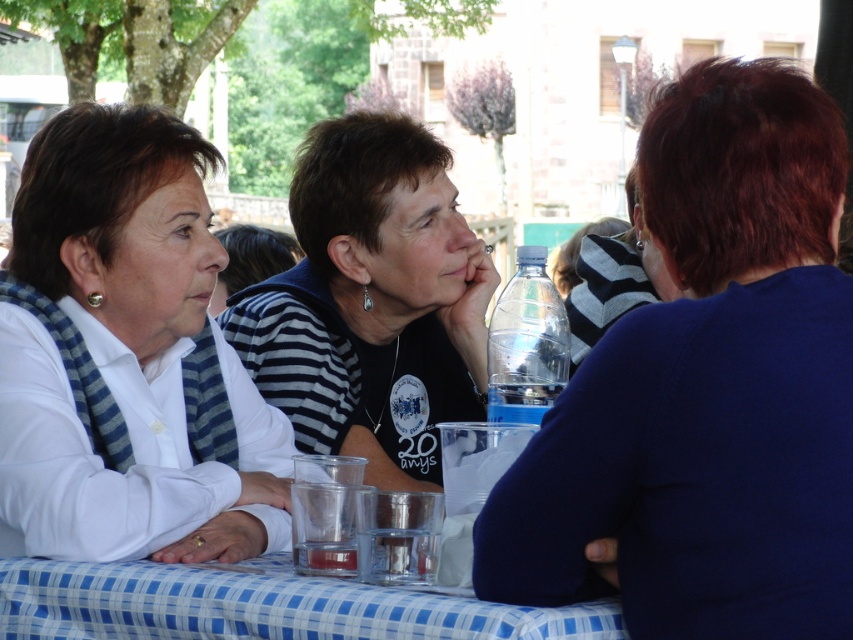
How distant is blue matte shirt at right from matte black shirt at center?

blue matte shirt at right is 8.18 feet away from matte black shirt at center.

Consider the image. Can you confirm if blue matte shirt at right is positioned below matte black shirt at center?

Yes.

Which is behind, point (827, 416) or point (389, 348)?

The point (389, 348) is behind.

Locate an element on the screen. blue matte shirt at right is located at coordinates (706, 388).

Can you confirm if white matte shirt at left is shorter than matte black shirt at center?

Indeed, white matte shirt at left has a lesser height compared to matte black shirt at center.

Between white matte shirt at left and matte black shirt at center, which one has more height?

Standing taller between the two is matte black shirt at center.

Where is `white matte shirt at left`? white matte shirt at left is located at coordinates click(126, 356).

Does point (729, 248) lie in front of point (289, 624)?

No.

Between point (822, 604) and point (550, 632), which one is positioned behind?

The point (550, 632) is behind.

Image resolution: width=853 pixels, height=640 pixels. Identify the location of blue matte shirt at right. (706, 388).

You are a GUI agent. You are given a task and a screenshot of the screen. Output one action in this format:
    pyautogui.click(x=<x>, y=<y>)
    Task: Click on the blue matte shirt at right
    
    Given the screenshot: What is the action you would take?
    pyautogui.click(x=706, y=388)